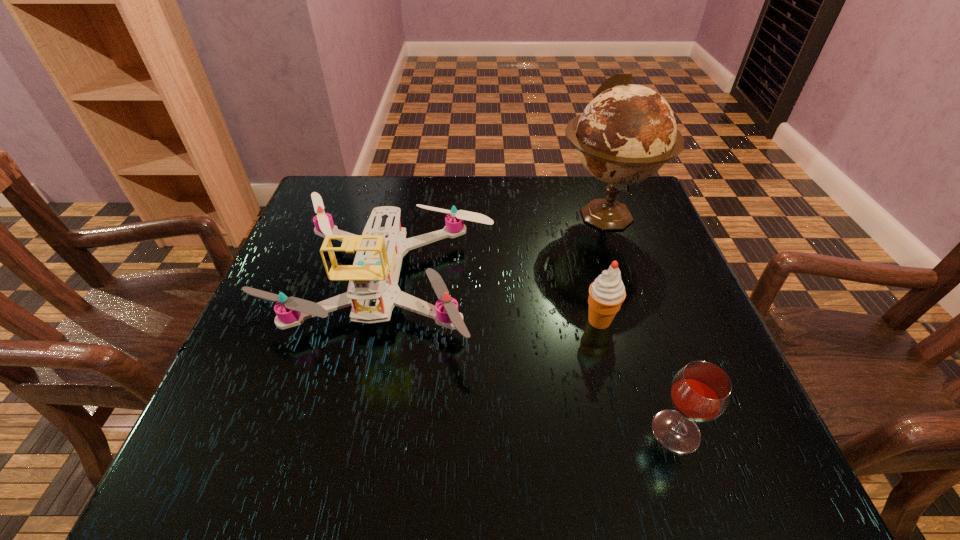
The height and width of the screenshot is (540, 960). Find the location of `vacant space at the left edge of the desktop`. vacant space at the left edge of the desktop is located at coordinates (315, 260).

Image resolution: width=960 pixels, height=540 pixels. In the image, there is a desktop. Find the location of `free region at the right edge`. free region at the right edge is located at coordinates (656, 355).

Image resolution: width=960 pixels, height=540 pixels. In the image, there is a desktop. In order to click on free space at the far left corner in this screenshot , I will do `click(370, 183)`.

Find the location of a particular element. vacant space at the near right corner is located at coordinates (750, 438).

At what (x,y) coordinates should I click in order to perform the action: click on vacant space that's between the nearest object and the tallest object. Please return your answer as a coordinate pair (x, y). Looking at the image, I should click on (640, 324).

Identify the location of vacant space that's between the second tallest object and the globe. (494, 250).

What are the coordinates of `vacant region between the leftmost object and the icecream` in the screenshot? It's located at (492, 302).

At what (x,y) coordinates should I click in order to perform the action: click on free space between the icecream and the tallest object. Please return your answer as a coordinate pair (x, y). The height and width of the screenshot is (540, 960). Looking at the image, I should click on (602, 268).

You are a GUI agent. You are given a task and a screenshot of the screen. Output one action in this format:
    pyautogui.click(x=<x>, y=<y>)
    Task: Click on the unoccupied position between the second tallest object and the globe
    
    Given the screenshot: What is the action you would take?
    pyautogui.click(x=494, y=250)

Image resolution: width=960 pixels, height=540 pixels. Find the location of `unoccupied area between the tallest object and the icecream`. unoccupied area between the tallest object and the icecream is located at coordinates (602, 268).